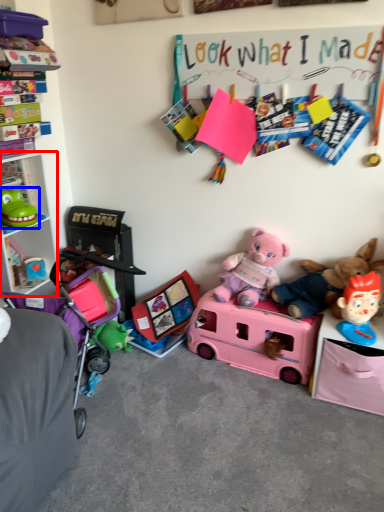
Question: Which of the following is the farthest to the observer, cabinet (highlighted by a red box) or toy (highlighted by a blue box)?

Choices:
 (A) cabinet
 (B) toy

Answer: (B)